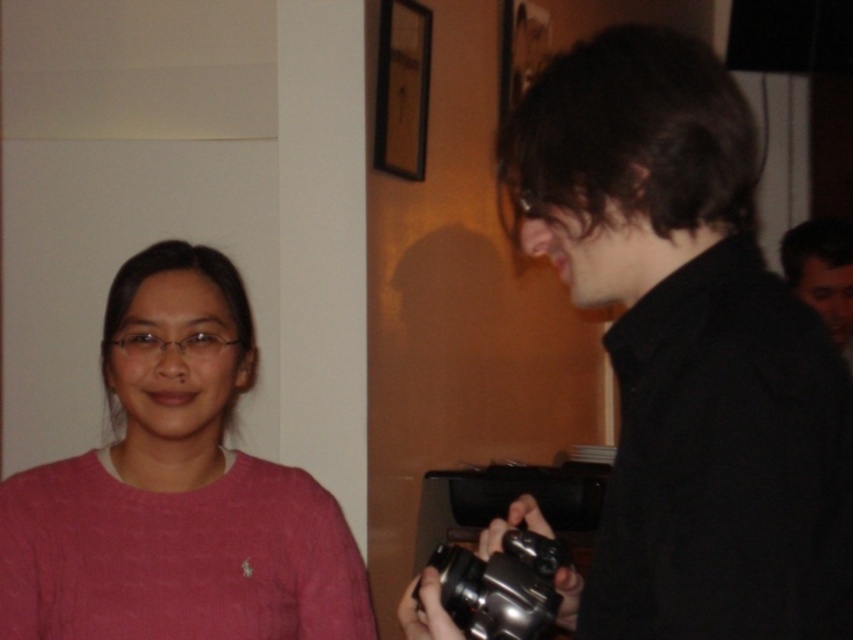
You are standing in the room and want to take a photo of the person in the pink sweater. The metallic silver camera at lower center is located at point (502, 586). Is the camera positioned in a way that it can capture the person in the pink sweater without any obstruction?

The metallic silver camera at lower center is positioned at point (502, 586), which is the lower center of the image. Since the person in the pink sweater is on the left side of the frame and the camera is at the lower center, there is no obstruction mentioned in the scene description. Therefore, the camera can likely capture the person in the pink sweater without any obstruction.

You are a photographer trying to capture a candid shot of the person on the right. Since the dark brown hair at right is blocking your view of the black matte camera at right, can you adjust your position to see both clearly?

The black matte camera at right is below the dark brown hair at right, so if you move your position slightly upwards, you can see both the dark brown hair at right and the black matte camera at right without obstruction.

You are standing in front of the scene and want to take a photo of the person in the pink sweater at left using the black matte camera at right. Can you reach the camera without moving your position?

The black matte camera at right is 26.17 inches from viewer, so yes, you can reach it without moving your position since the distance is within a comfortable arm reach.